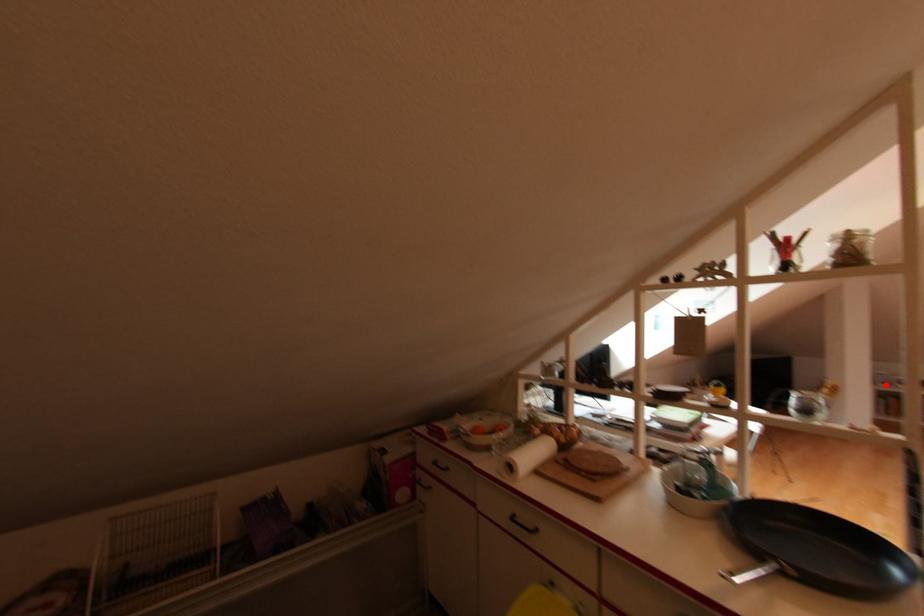
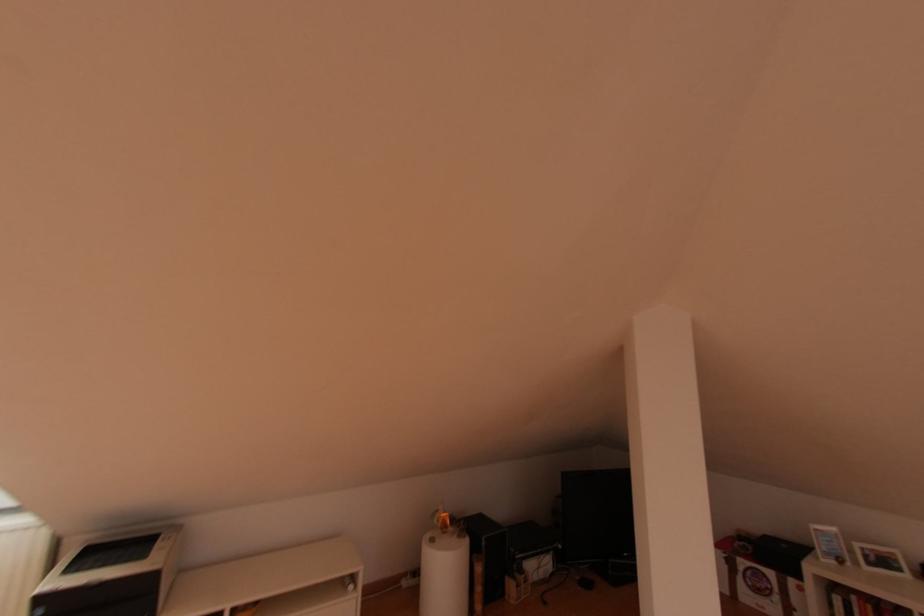
Question: I am providing you with two images of the same scene from different viewpoints. A red point is shown in image1. For the corresponding object point in image2, is it positioned nearer or farther from the camera?

Choices:
 (A) Nearer
 (B) Farther

Answer: (A)